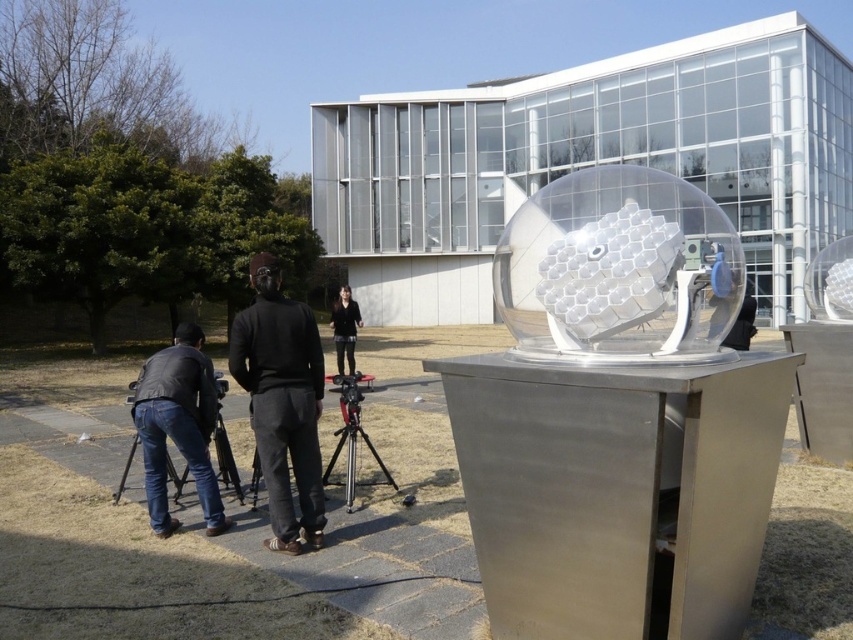
Which is below, transparent plastic sphere at center or jeans at lower left?

jeans at lower left

Locate an element on the screen. This screenshot has width=853, height=640. transparent plastic sphere at center is located at coordinates (618, 269).

Does point (279, 300) come farther from viewer compared to point (221, 381)?

No.

The image size is (853, 640). I want to click on black matte pants at center, so click(282, 401).

Between point (265, 413) and point (172, 474), which one is positioned in front?

Point (265, 413) is in front.

Identify the location of black matte pants at center. The height and width of the screenshot is (640, 853). (282, 401).

Is transparent plastic sphere at center to the right of matte black tripod at lower left from the viewer's perspective?

→ Correct, you'll find transparent plastic sphere at center to the right of matte black tripod at lower left.

Is transparent plastic sphere at center wider than matte black tripod at lower left?

Incorrect, transparent plastic sphere at center's width does not surpass matte black tripod at lower left's.

Who is more forward, [585,188] or [216,417]?

Point [585,188]

This screenshot has height=640, width=853. Find the location of `transparent plastic sphere at center`. transparent plastic sphere at center is located at coordinates (618, 269).